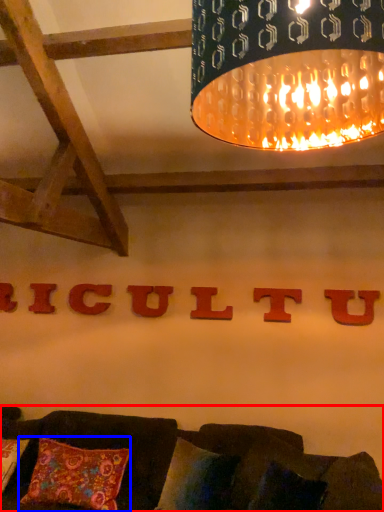
Question: Which of the following is the farthest to the observer, studio couch (highlighted by a red box) or pillow (highlighted by a blue box)?

Choices:
 (A) studio couch
 (B) pillow

Answer: (B)